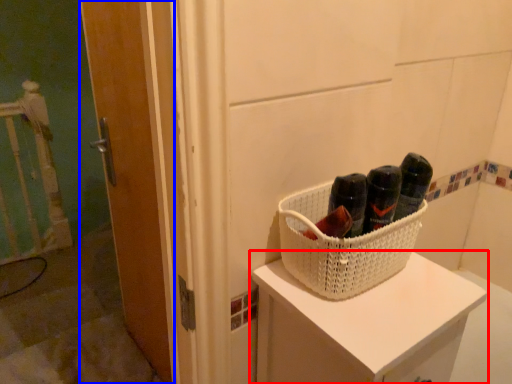
Question: Among these objects, which one is farthest to the camera, furniture (highlighted by a red box) or door (highlighted by a blue box)?

Choices:
 (A) furniture
 (B) door

Answer: (B)